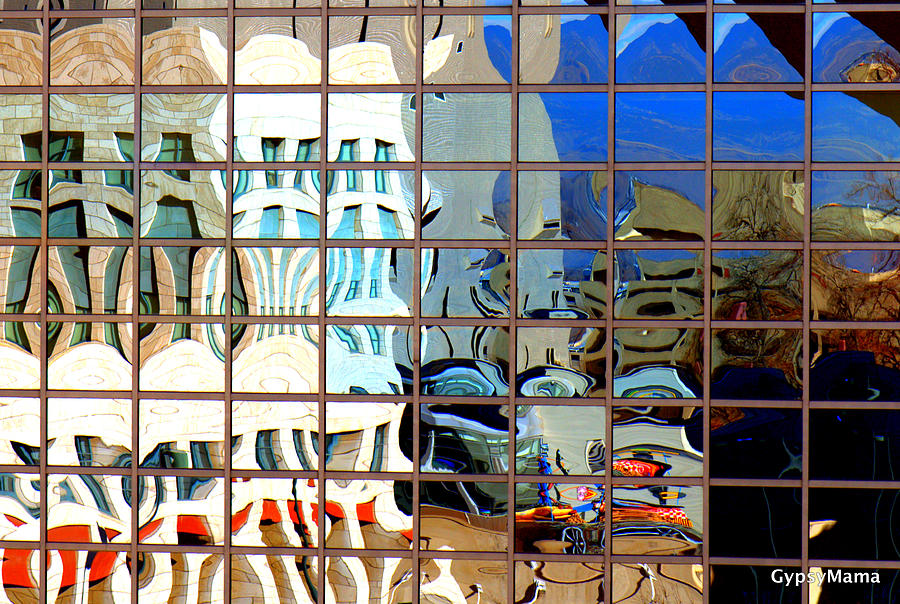
The image size is (900, 604). In order to click on light grey wall in this screenshot , I will do `click(572, 432)`.